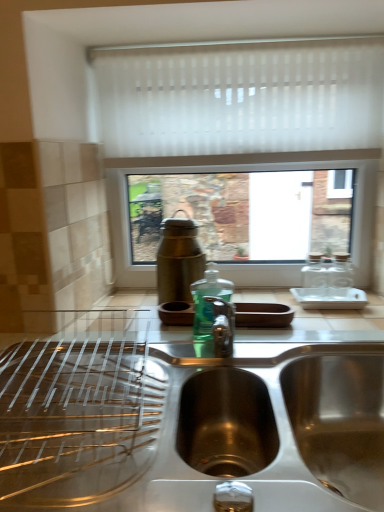
What do you see at coordinates (187, 418) in the screenshot?
I see `stainless steel sink at center` at bounding box center [187, 418].

You are a GUI agent. You are given a task and a screenshot of the screen. Output one action in this format:
    pyautogui.click(x=<x>, y=<y>)
    Task: Click on the stainless steel sink at center
    
    Given the screenshot: What is the action you would take?
    pyautogui.click(x=187, y=418)

This screenshot has height=512, width=384. In order to click on white sheer curtain at upper center in this screenshot , I will do `click(240, 96)`.

What do you see at coordinates (240, 96) in the screenshot? The height and width of the screenshot is (512, 384). I see `white sheer curtain at upper center` at bounding box center [240, 96].

Locate an element on the screen. stainless steel sink at center is located at coordinates (187, 418).

Based on the photo, would you say white sheer curtain at upper center is to the left or to the right of stainless steel sink at center in the picture?

In the image, white sheer curtain at upper center appears on the right side of stainless steel sink at center.

Is white sheer curtain at upper center further to the viewer compared to stainless steel sink at center?

That is True.

Consider the image. Which is closer, (272, 96) or (314, 506)?

Point (272, 96).

From the image's perspective, which one is positioned higher, white sheer curtain at upper center or stainless steel sink at center?

white sheer curtain at upper center is shown above in the image.

From a real-world perspective, which is physically above, white sheer curtain at upper center or stainless steel sink at center?

white sheer curtain at upper center, from a real-world perspective.

Can you confirm if white sheer curtain at upper center is wider than stainless steel sink at center?

Incorrect, the width of white sheer curtain at upper center does not surpass that of stainless steel sink at center.

Which of these two, white sheer curtain at upper center or stainless steel sink at center, stands taller?

Standing taller between the two is white sheer curtain at upper center.

Can you confirm if white sheer curtain at upper center is bigger than stainless steel sink at center?

No, white sheer curtain at upper center is not bigger than stainless steel sink at center.

Is white sheer curtain at upper center surrounding stainless steel sink at center?

No, white sheer curtain at upper center does not contain stainless steel sink at center.

Are white sheer curtain at upper center and stainless steel sink at center making contact?

No, white sheer curtain at upper center is not with stainless steel sink at center.

Could you tell me if white sheer curtain at upper center is facing stainless steel sink at center?

No, white sheer curtain at upper center is not oriented towards stainless steel sink at center.

How different are the orientations of white sheer curtain at upper center and stainless steel sink at center in degrees?

white sheer curtain at upper center and stainless steel sink at center are facing 0.852 degrees away from each other.

Locate an element on the screen. curtain above the stainless steel sink at center (from a real-world perspective) is located at coordinates (240, 96).

Would you say stainless steel sink at center is to the left or to the right of white sheer curtain at upper center in the picture?

From the image, it's evident that stainless steel sink at center is to the left of white sheer curtain at upper center.

Based on the photo, which object is further away from the camera taking this photo, stainless steel sink at center or white sheer curtain at upper center?

white sheer curtain at upper center is behind.

Does point (233, 401) come behind point (363, 79)?

That is False.

In the scene shown: From the image's perspective, is stainless steel sink at center on white sheer curtain at upper center?

Incorrect, from the image's perspective, stainless steel sink at center is lower than white sheer curtain at upper center.

From a real-world perspective, who is located higher, stainless steel sink at center or white sheer curtain at upper center?

white sheer curtain at upper center, from a real-world perspective.

Is stainless steel sink at center wider than white sheer curtain at upper center?

Correct, the width of stainless steel sink at center exceeds that of white sheer curtain at upper center.

In the scene shown: Does stainless steel sink at center have a greater height compared to white sheer curtain at upper center?

Incorrect, the height of stainless steel sink at center is not larger of that of white sheer curtain at upper center.

Based on the photo, considering the sizes of objects stainless steel sink at center and white sheer curtain at upper center in the image provided, who is smaller, stainless steel sink at center or white sheer curtain at upper center?

With smaller size is white sheer curtain at upper center.

Would you say stainless steel sink at center is inside or outside white sheer curtain at upper center?

stainless steel sink at center is not enclosed by white sheer curtain at upper center.

Can you see stainless steel sink at center touching white sheer curtain at upper center?

No.

Is stainless steel sink at center oriented towards white sheer curtain at upper center?

No, stainless steel sink at center is not oriented towards white sheer curtain at upper center.

Image resolution: width=384 pixels, height=512 pixels. In order to click on countertop located in front of the white sheer curtain at upper center in this screenshot , I will do `click(187, 418)`.

This screenshot has width=384, height=512. I want to click on curtain that appears behind the stainless steel sink at center, so click(240, 96).

Image resolution: width=384 pixels, height=512 pixels. I want to click on countertop below the white sheer curtain at upper center (from the image's perspective), so click(x=187, y=418).